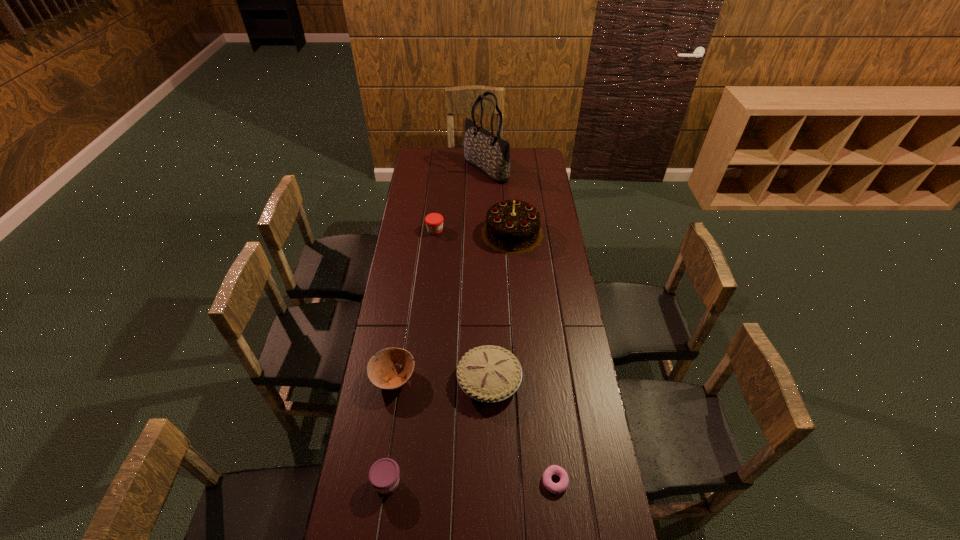
Locate an element on the screen. The height and width of the screenshot is (540, 960). free location that satisfies the following two spatial constraints: 1. on the front side of the pie; 2. on the left side of the bowl is located at coordinates (394, 380).